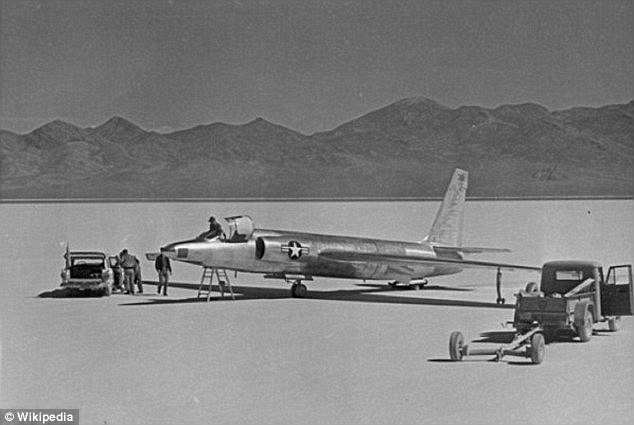
The image size is (634, 425). I want to click on glass, so click(x=569, y=272).